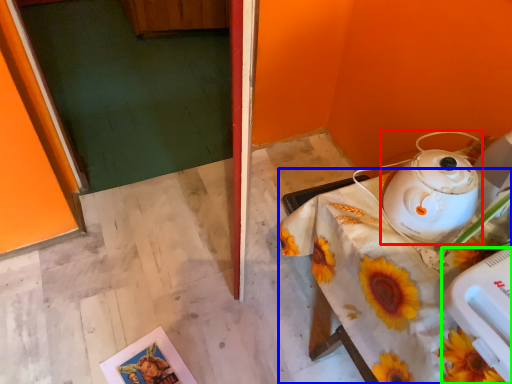
Question: Which object is positioned closest to kettle (highlighted by a red box)? Select from table (highlighted by a blue box) and appliance (highlighted by a green box).

Choices:
 (A) table
 (B) appliance

Answer: (A)